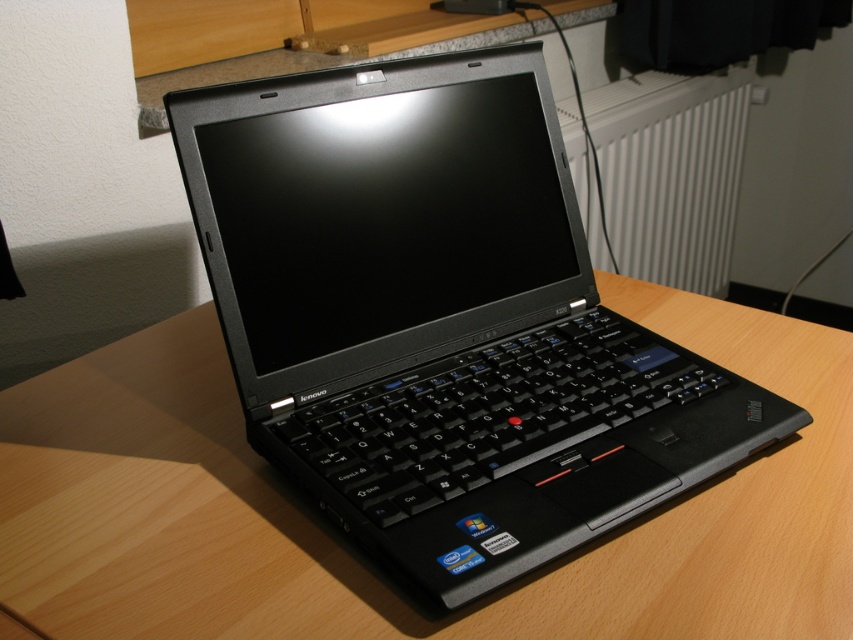
Is black plastic laptop at center bigger than white plastic radiator at upper center?

Incorrect, black plastic laptop at center is not larger than white plastic radiator at upper center.

Which is above, black plastic laptop at center or white plastic radiator at upper center?

white plastic radiator at upper center is higher up.

Is point (555, 380) positioned after point (641, 204)?

No, it is in front of (641, 204).

Where is `black plastic laptop at center`? Image resolution: width=853 pixels, height=640 pixels. black plastic laptop at center is located at coordinates (440, 317).

Is black plastic laptop at center closer to camera compared to wooden table at center?

That is True.

Is black plastic laptop at center to the left of wooden table at center from the viewer's perspective?

Indeed, black plastic laptop at center is positioned on the left side of wooden table at center.

Find the location of a particular element. Image resolution: width=853 pixels, height=640 pixels. black plastic laptop at center is located at coordinates (440, 317).

Find the location of a particular element. The height and width of the screenshot is (640, 853). black plastic laptop at center is located at coordinates (440, 317).

Who is more distant from viewer, (675,598) or (572,138)?

Positioned behind is point (572,138).

Who is positioned more to the left, wooden table at center or white plastic radiator at upper center?

From the viewer's perspective, wooden table at center appears more on the left side.

Is point (596, 588) closer to viewer compared to point (735, 172)?

Yes, point (596, 588) is in front of point (735, 172).

The width and height of the screenshot is (853, 640). What are the coordinates of `wooden table at center` in the screenshot? It's located at (355, 552).